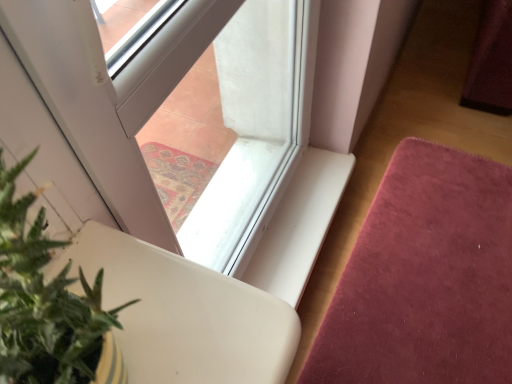
Question: Is transparent glass window at center in front of or behind green leafy plant at lower left in the image?

Choices:
 (A) behind
 (B) front

Answer: (A)

Question: Considering the positions of transparent glass window at center and green leafy plant at lower left in the image, is transparent glass window at center wider or thinner than green leafy plant at lower left?

Choices:
 (A) thin
 (B) wide

Answer: (A)

Question: Which of these objects is positioned farthest from the transparent glass window at center?

Choices:
 (A) velvet pink mat at lower right
 (B) green leafy plant at lower left

Answer: (B)

Question: Considering the real-world distances, which object is farthest from the transparent glass window at center?

Choices:
 (A) velvet pink mat at lower right
 (B) green leafy plant at lower left

Answer: (B)